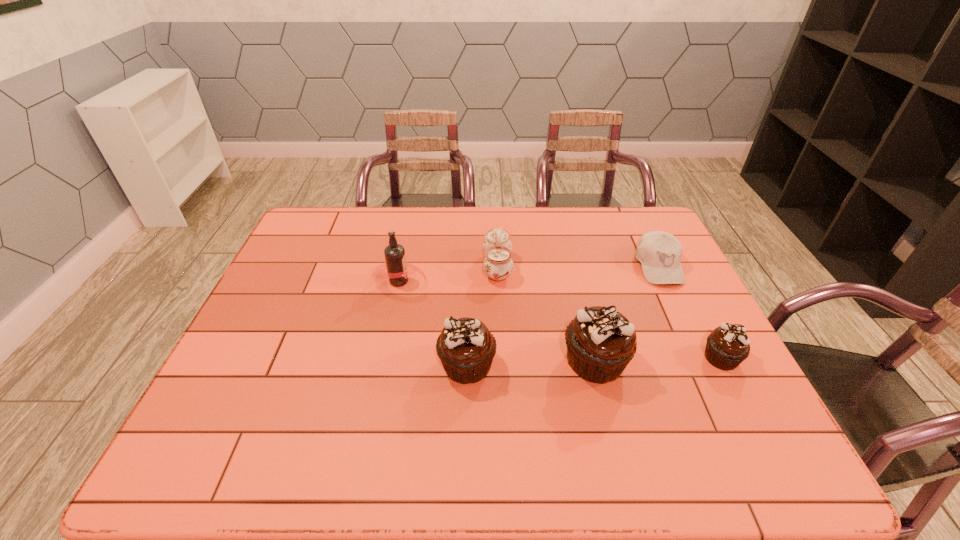
Where is `vacant area at the far right corner of the desktop`? The width and height of the screenshot is (960, 540). vacant area at the far right corner of the desktop is located at coordinates (622, 240).

Locate an element on the screen. The image size is (960, 540). blank region between the leftmost cupcake and the leftmost object is located at coordinates (433, 323).

Identify the location of vacant region between the leftmost object and the baseball cap. (529, 274).

You are a GUI agent. You are given a task and a screenshot of the screen. Output one action in this format:
    pyautogui.click(x=<x>, y=<y>)
    Task: Click on the empty space that is in between the rightmost cupcake and the fourth object from left to right
    The width and height of the screenshot is (960, 540).
    Given the screenshot: What is the action you would take?
    pyautogui.click(x=659, y=360)

Where is `empty space that is in between the baseball cap and the root beer`? This screenshot has width=960, height=540. empty space that is in between the baseball cap and the root beer is located at coordinates (529, 274).

The image size is (960, 540). I want to click on vacant space that is in between the baseball cap and the chinaware, so click(578, 267).

At what (x,y) coordinates should I click in order to perform the action: click on blank region between the chinaware and the third object from right to left. Please return your answer as a coordinate pair (x, y). The width and height of the screenshot is (960, 540). Looking at the image, I should click on (546, 314).

Image resolution: width=960 pixels, height=540 pixels. Find the location of `free space between the fourth object from left to right and the leftmost cupcake`. free space between the fourth object from left to right and the leftmost cupcake is located at coordinates (531, 363).

Locate an element on the screen. This screenshot has width=960, height=540. unoccupied position between the baseball cap and the chinaware is located at coordinates (578, 267).

Find the location of a particular element. This screenshot has width=960, height=540. vacant area between the chinaware and the second cupcake from left to right is located at coordinates (546, 314).